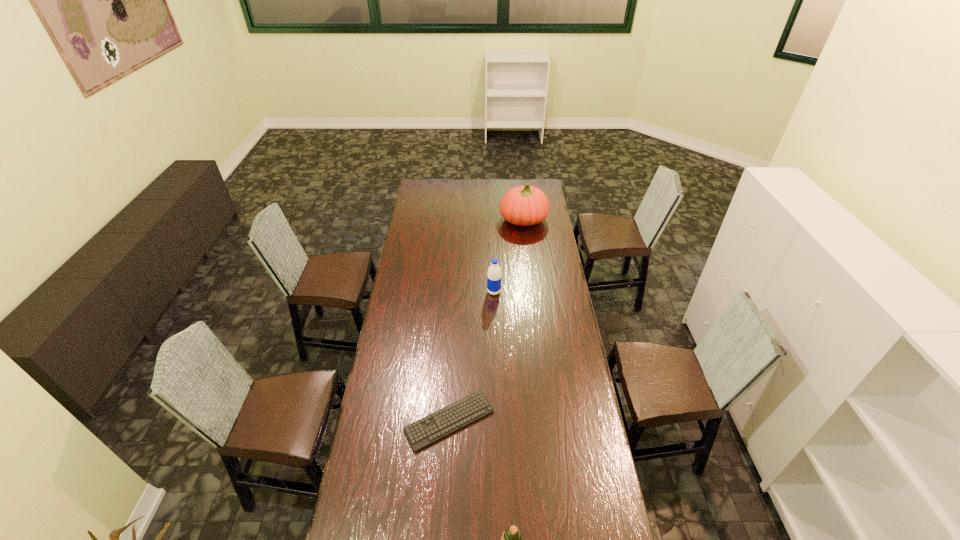
At what (x,y) coordinates should I click in order to perform the action: click on free point at the far edge. Please return your answer as a coordinate pair (x, y). Looking at the image, I should click on (443, 185).

Locate an element on the screen. free space at the left edge of the desktop is located at coordinates (411, 225).

What are the coordinates of `vacant space at the right edge of the desktop` in the screenshot? It's located at (555, 242).

In the image, there is a desktop. Where is `vacant space at the far left corner`? vacant space at the far left corner is located at coordinates tap(426, 187).

Where is `unoccupied area between the farthest object and the third nearest object`? The height and width of the screenshot is (540, 960). unoccupied area between the farthest object and the third nearest object is located at coordinates (509, 256).

This screenshot has width=960, height=540. I want to click on free space between the third farthest object and the water bottle, so click(471, 356).

The image size is (960, 540). Identify the location of blank region between the tallest object and the water bottle. (509, 256).

You are a GUI agent. You are given a task and a screenshot of the screen. Output one action in this format:
    pyautogui.click(x=<x>, y=<y>)
    Task: Click on the second closest object to the olive oil
    
    Given the screenshot: What is the action you would take?
    pyautogui.click(x=494, y=272)

You are a GUI agent. You are given a task and a screenshot of the screen. Output one action in this format:
    pyautogui.click(x=<x>, y=<y>)
    Task: Click on the object that stands as the second closest to the nearest object
    Image resolution: width=960 pixels, height=540 pixels.
    Given the screenshot: What is the action you would take?
    pyautogui.click(x=494, y=272)

The image size is (960, 540). What are the coordinates of `blank area in the image that satisfies the following two spatial constraints: 1. on the back side of the pumpkin; 2. on the right side of the water bottle` in the screenshot? It's located at (492, 220).